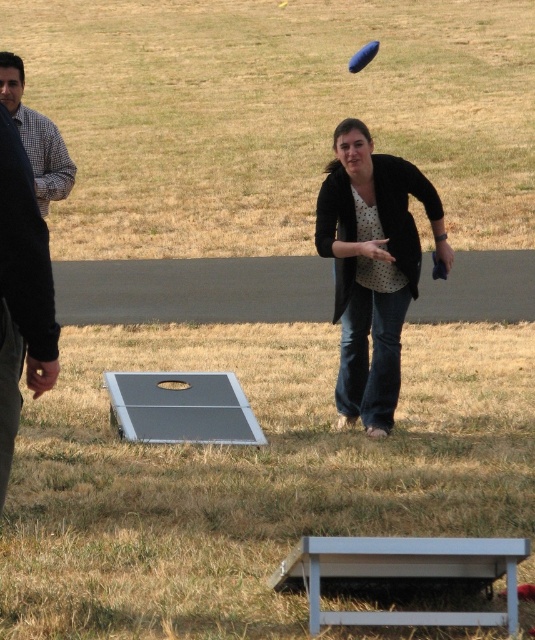
You are playing a game and need to place a marker between the smooth gray board at center and the blue rubber frisbee at upper center. Which object should you place the marker closer to?

The smooth gray board at center is below the blue rubber frisbee at upper center, so you should place the marker closer to the smooth gray board at center since it is lower in position.